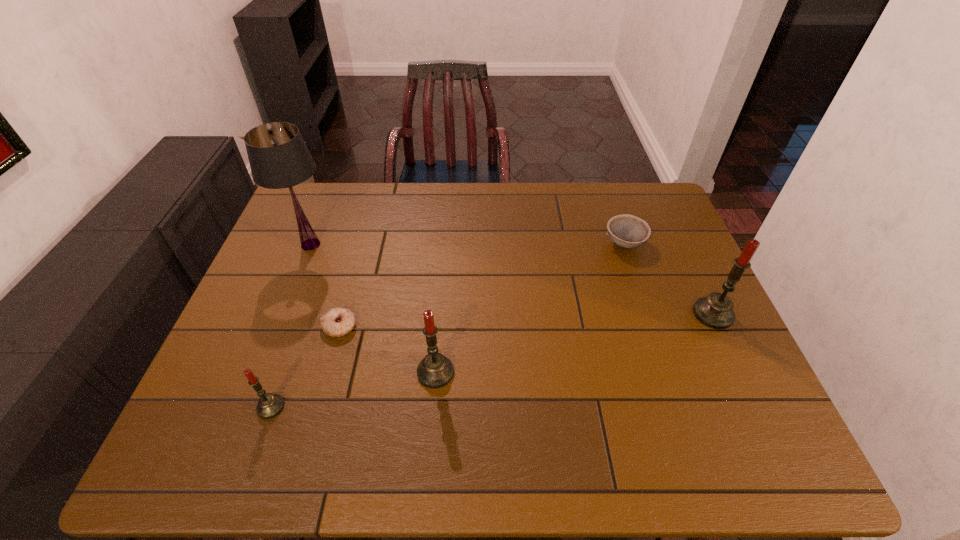
Choose which candle is the nearest neighbor to the fifth tallest object. Please provide its 2D coordinates. Your answer should be formatted as a tuple, i.e. [(x, y)], where the tuple contains the x and y coordinates of a point satisfying the conditions above.

[(716, 311)]

The width and height of the screenshot is (960, 540). I want to click on candle that is the nearest to the second farthest candle, so click(269, 405).

I want to click on vacant space that satisfies the following two spatial constraints: 1. on the front-facing side of the lampshade; 2. on the left side of the second candle from left to right, so click(x=260, y=372).

The image size is (960, 540). What are the coordinates of `free space that satisfies the following two spatial constraints: 1. on the front-facing side of the tallest object; 2. on the back side of the farthest candle` in the screenshot? It's located at (283, 314).

This screenshot has height=540, width=960. I want to click on free space in the image that satisfies the following two spatial constraints: 1. on the front-facing side of the tallest object; 2. on the right side of the farthest candle, so click(x=283, y=314).